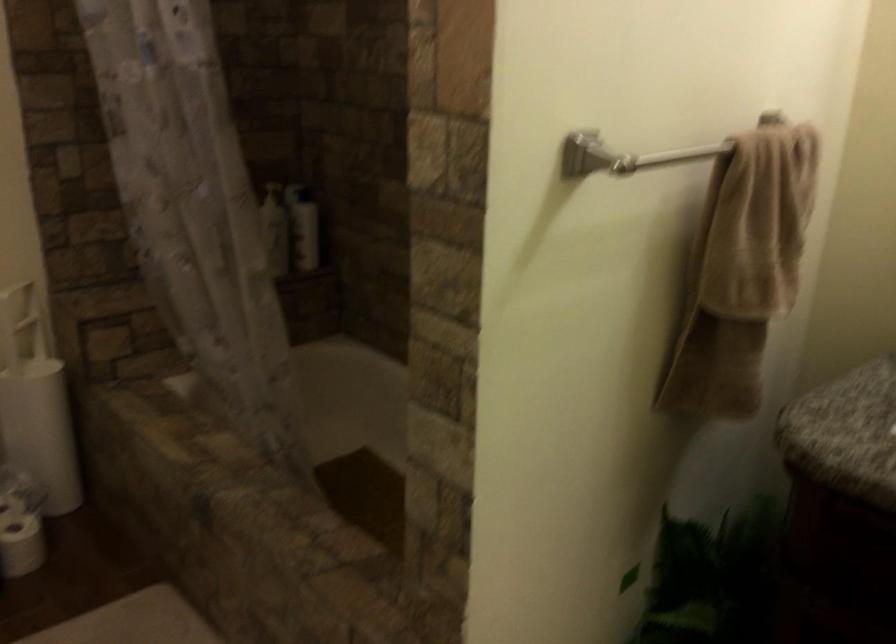
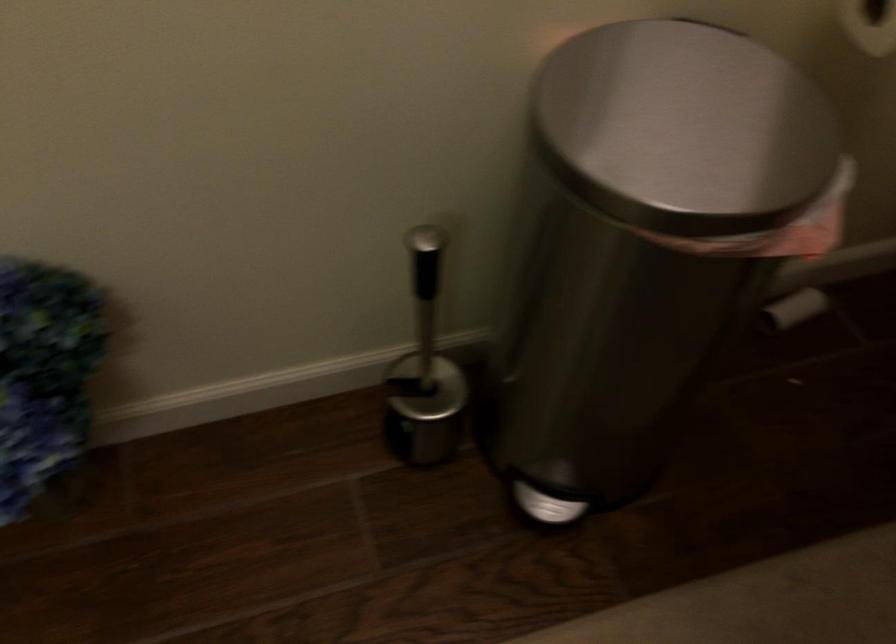
Looking at this image, based on the continuous images, in which direction is the camera rotating?

The rotation direction of the camera is left-down.